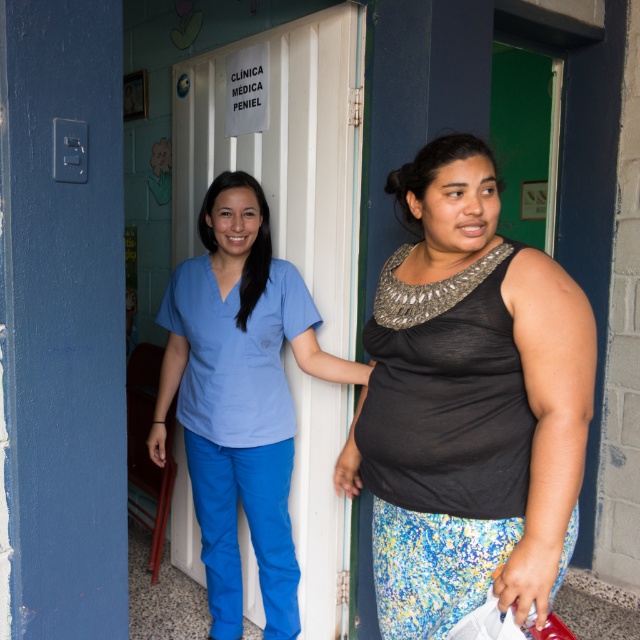
Question: Does matte blue scrubs at center appear on the left side of blue fabric scrub at center?

Choices:
 (A) no
 (B) yes

Answer: (B)

Question: Which object is positioned farthest from the matte blue scrubs at center?

Choices:
 (A) black sheer top at center
 (B) matte blue pants at lower left

Answer: (A)

Question: Which point is farther to the camera?

Choices:
 (A) (451, 612)
 (B) (269, 461)

Answer: (B)

Question: Considering the relative positions of black sheer top at center and matte blue scrubs at center in the image provided, where is black sheer top at center located with respect to matte blue scrubs at center?

Choices:
 (A) above
 (B) below

Answer: (A)

Question: Which object is the closest to the black sheer top at center?

Choices:
 (A) matte blue pants at lower left
 (B) blue fabric scrub at center
 (C) matte blue scrubs at center

Answer: (B)

Question: Is black sheer top at center in front of matte blue pants at lower left?

Choices:
 (A) yes
 (B) no

Answer: (A)